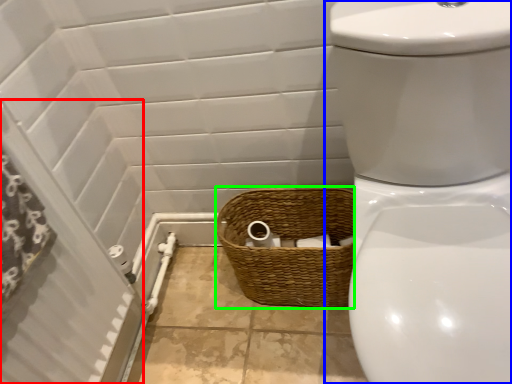
Question: Which is farther away from screen door (highlighted by a red box)? toilet (highlighted by a blue box) or basket (highlighted by a green box)?

Choices:
 (A) toilet
 (B) basket

Answer: (A)